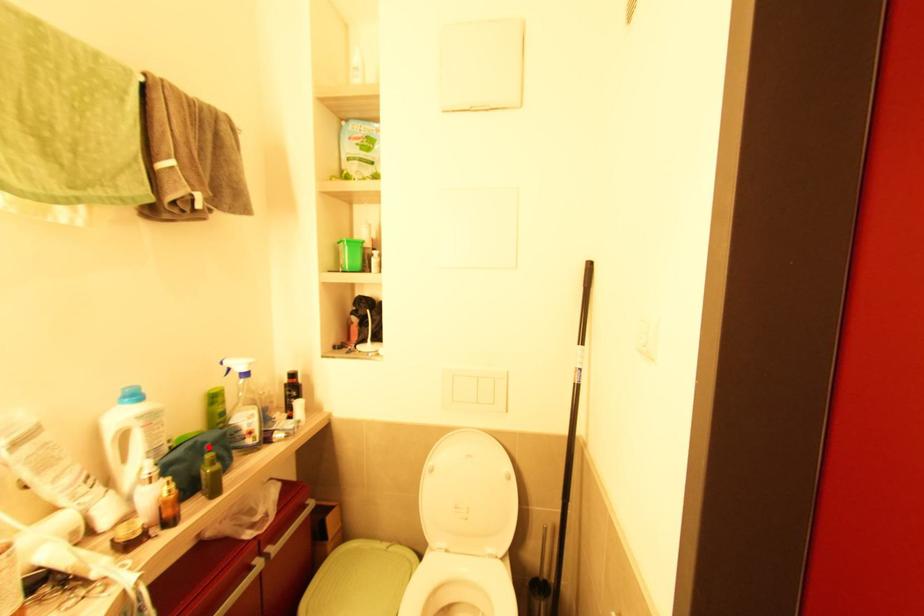
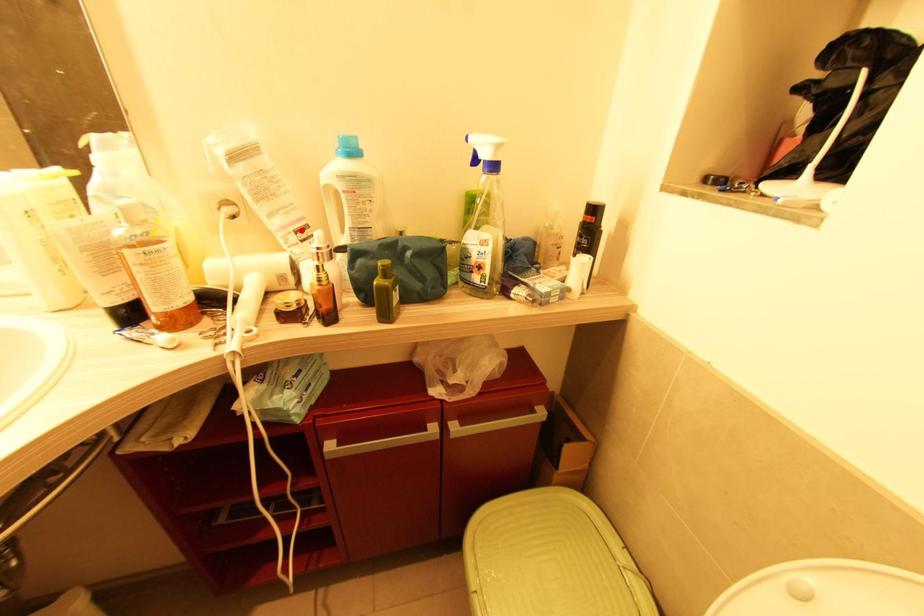
I am providing you with two images of the same scene from different viewpoints. A red point is marked on the first image and another point is marked on the second image. Is the marked point in image1 the same physical position as the marked point in image2?

No